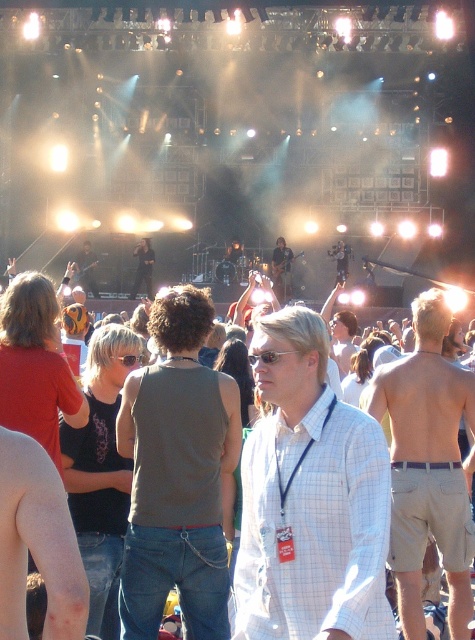
Question: Is dark gray tank top at center smaller than matte black tank top at center?

Choices:
 (A) no
 (B) yes

Answer: (A)

Question: Which point is closer to the camera?

Choices:
 (A) smooth skin arm at lower left
 (B) tan shorts at center

Answer: (A)

Question: Based on their relative distances, which object is nearer to the denim jeans at center?

Choices:
 (A) shiny black guitar at center
 (B) smooth skin arm at lower left
 (C) matte black tank top at center
 (D) dark gray tank top at center

Answer: (D)

Question: In this image, where is dark gray tank top at center located relative to matte black tank top at center?

Choices:
 (A) below
 (B) above

Answer: (A)

Question: Does denim jeans at center appear over shiny black guitar at center?

Choices:
 (A) yes
 (B) no

Answer: (B)

Question: Estimate the real-world distances between objects in this image. Which object is closer to the denim jeans at center?

Choices:
 (A) shiny black guitar at center
 (B) white checkered shirt at center

Answer: (B)